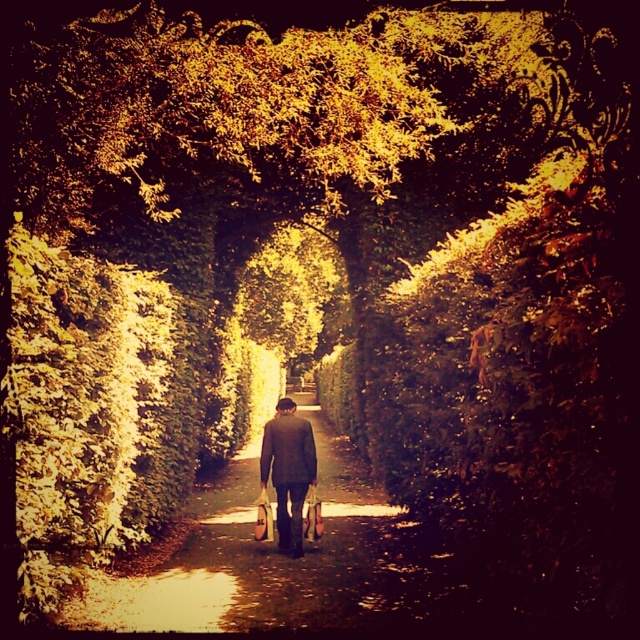
You are a photographer trying to capture the scene of the person walking down the path. Based on the height difference between the brown textured path at center and the dark brown suit at center, which object would appear closer to the camera in the photo?

The dark brown suit at center appears closer to the camera because it has a greater height than the brown textured path at center, making it more prominent in the frame.